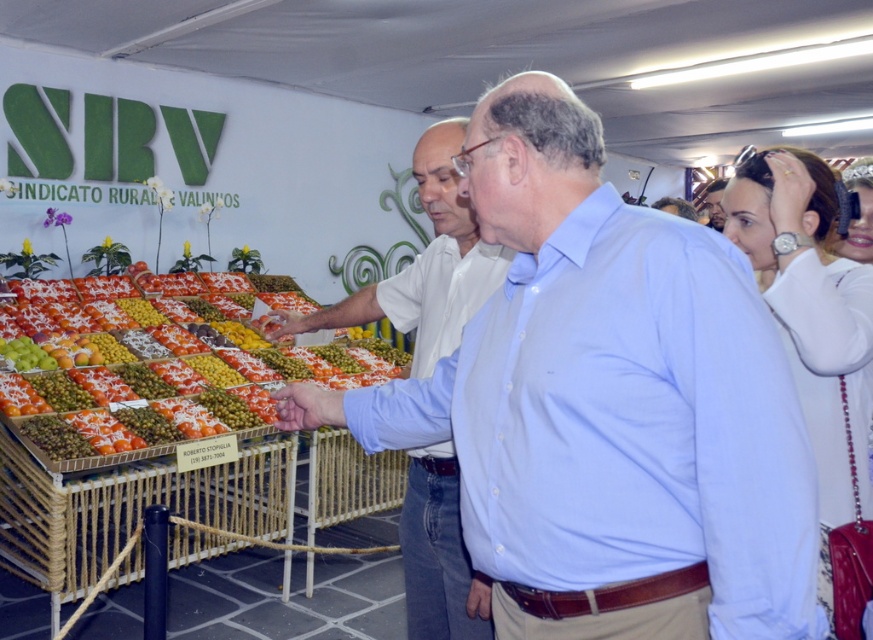
Is light blue shirt at center below matte white shirt at center?

Yes.

Is point (275, 310) in front of point (713, 186)?

Yes, point (275, 310) is closer to viewer.

Between point (479, 291) and point (720, 212), which one is positioned in front?

Positioned in front is point (479, 291).

Locate an element on the screen. The height and width of the screenshot is (640, 873). light blue shirt at center is located at coordinates (425, 266).

Is point (452, 588) behind point (293, 365)?

That is False.

Image resolution: width=873 pixels, height=640 pixels. Describe the element at coordinates (425, 266) in the screenshot. I see `light blue shirt at center` at that location.

This screenshot has width=873, height=640. What do you see at coordinates (425, 266) in the screenshot?
I see `light blue shirt at center` at bounding box center [425, 266].

You are a GUI agent. You are given a task and a screenshot of the screen. Output one action in this format:
    pyautogui.click(x=<x>, y=<y>)
    Task: Click on the light blue shirt at center
    The width and height of the screenshot is (873, 640).
    Given the screenshot: What is the action you would take?
    pyautogui.click(x=425, y=266)

Is shiny plastic tray at center taller than matte white shirt at center?

Correct, shiny plastic tray at center is much taller as matte white shirt at center.

Which is in front, point (71, 320) or point (718, 225)?

Point (718, 225)

What are the coordinates of `shiny plastic tray at center` in the screenshot? It's located at coord(135,397).